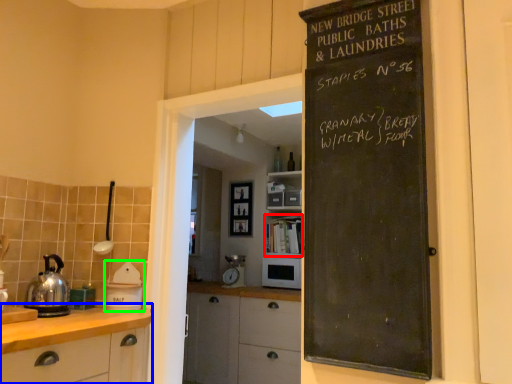
Question: Which is nearer to the shelf (highlighted by a red box)? cabinetry (highlighted by a blue box) or appliance (highlighted by a green box).

Choices:
 (A) cabinetry
 (B) appliance

Answer: (B)